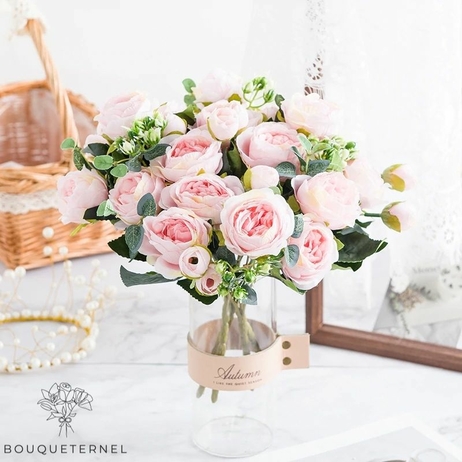
Identify the location of mirror. The image size is (462, 462). click(360, 288), click(435, 310), click(432, 223), click(366, 268), click(406, 237), click(450, 256), click(333, 314).